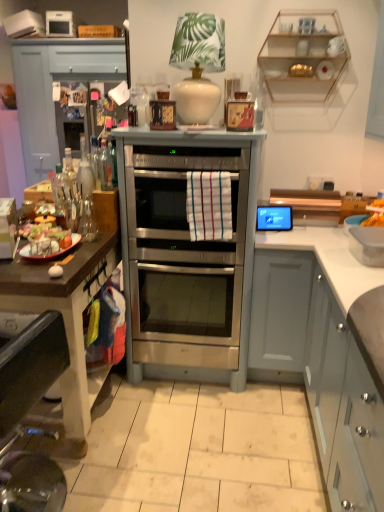
Question: Is brushed metal drawer at upper left positioned beyond the bounds of clear glass shelves at upper right?

Choices:
 (A) no
 (B) yes

Answer: (B)

Question: Considering the relative sizes of brushed metal drawer at upper left and clear glass shelves at upper right in the image provided, is brushed metal drawer at upper left smaller than clear glass shelves at upper right?

Choices:
 (A) no
 (B) yes

Answer: (A)

Question: From the image's perspective, is brushed metal drawer at upper left under clear glass shelves at upper right?

Choices:
 (A) no
 (B) yes

Answer: (A)

Question: From a real-world perspective, is brushed metal drawer at upper left positioned over clear glass shelves at upper right based on gravity?

Choices:
 (A) yes
 (B) no

Answer: (A)

Question: Are brushed metal drawer at upper left and clear glass shelves at upper right far apart?

Choices:
 (A) no
 (B) yes

Answer: (B)

Question: Is shiny plastic tray at left, the 1th food in the front-to-back sequence, situated inside white matte cabinet at right, which is the 3th cabinetry in top-to-bottom order, or outside?

Choices:
 (A) outside
 (B) inside

Answer: (A)

Question: Considering the relative positions of shiny plastic tray at left, arranged as the second food when viewed from the right, and white matte cabinet at right, which is the 3th cabinetry in top-to-bottom order, in the image provided, is shiny plastic tray at left, arranged as the second food when viewed from the right, to the left or to the right of white matte cabinet at right, which is the 3th cabinetry in top-to-bottom order,?

Choices:
 (A) left
 (B) right

Answer: (A)

Question: Does point (66, 231) appear closer or farther from the camera than point (301, 287)?

Choices:
 (A) closer
 (B) farther

Answer: (A)

Question: Considering the positions of shiny plastic tray at left, arranged as the second food when viewed from the right, and white matte cabinet at right, which ranks as the 1th cabinetry in right-to-left order, in the image, is shiny plastic tray at left, arranged as the second food when viewed from the right, bigger or smaller than white matte cabinet at right, which ranks as the 1th cabinetry in right-to-left order,?

Choices:
 (A) big
 (B) small

Answer: (B)

Question: Relative to stainless steel oven at center, is clear glass bottle at left, acting as the 1th bottle starting from the right, in front or behind?

Choices:
 (A) front
 (B) behind

Answer: (A)

Question: From the image's perspective, is clear glass bottle at left, the 2th bottle positioned from the left, above or below stainless steel oven at center?

Choices:
 (A) below
 (B) above

Answer: (B)

Question: Considering the positions of clear glass bottle at left, the 2th bottle positioned from the left, and stainless steel oven at center in the image, is clear glass bottle at left, the 2th bottle positioned from the left, bigger or smaller than stainless steel oven at center?

Choices:
 (A) small
 (B) big

Answer: (A)

Question: Considering the relative positions of clear glass bottle at left, acting as the 1th bottle starting from the right, and stainless steel oven at center in the image provided, is clear glass bottle at left, acting as the 1th bottle starting from the right, to the left or to the right of stainless steel oven at center?

Choices:
 (A) right
 (B) left

Answer: (B)

Question: From the image's perspective, relative to white matte cabinet at right, which ranks as the 1th cabinetry in right-to-left order, is brushed metal drawer at upper left above or below?

Choices:
 (A) above
 (B) below

Answer: (A)

Question: Is brushed metal drawer at upper left wider or thinner than white matte cabinet at right, marked as the first cabinetry in a front-to-back arrangement?

Choices:
 (A) wide
 (B) thin

Answer: (A)